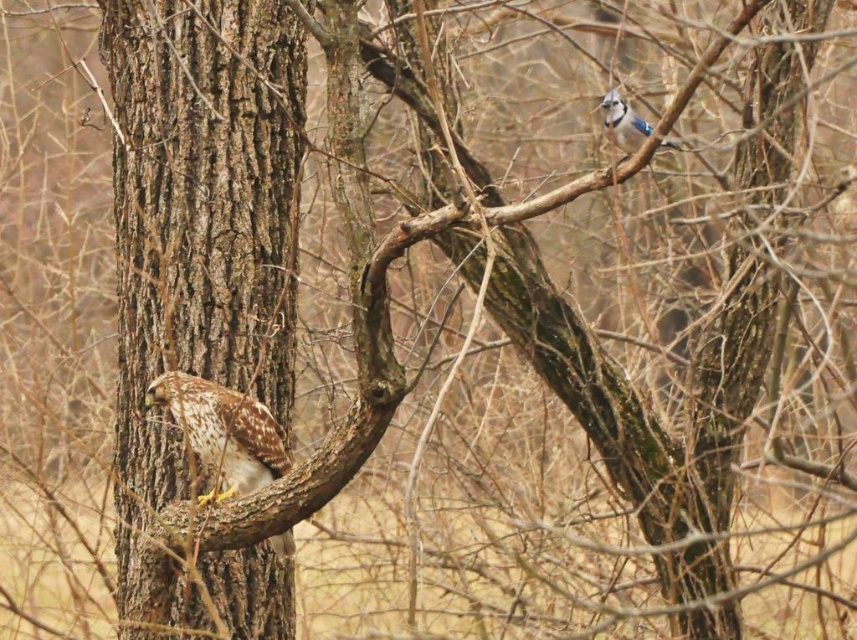
Question: Where is brown rough bark tree trunk at left located in relation to brown speckled feathers at left in the image?

Choices:
 (A) left
 (B) right

Answer: (A)

Question: Which object is the farthest from the blue speckled feathers at upper right?

Choices:
 (A) brown speckled feathers at left
 (B) brown rough bark tree trunk at left

Answer: (B)

Question: Which of the following is the farthest from the observer?

Choices:
 (A) (196, 589)
 (B) (620, 148)

Answer: (A)

Question: Is the position of brown speckled feathers at left less distant than that of blue speckled feathers at upper right?

Choices:
 (A) no
 (B) yes

Answer: (B)

Question: Which point is closer to the camera?

Choices:
 (A) (616, 115)
 (B) (162, 250)

Answer: (A)

Question: Does brown rough bark tree trunk at left appear on the left side of blue speckled feathers at upper right?

Choices:
 (A) yes
 (B) no

Answer: (A)